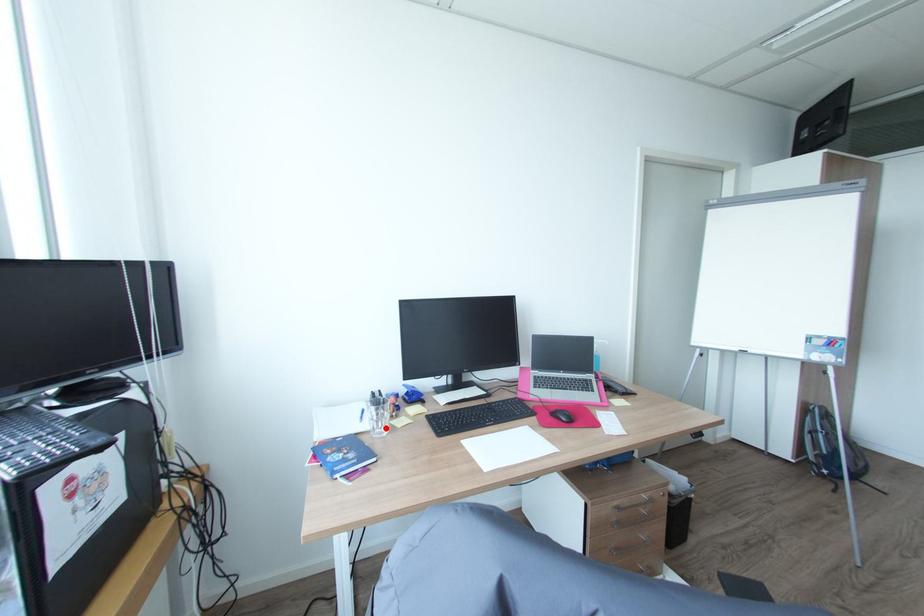
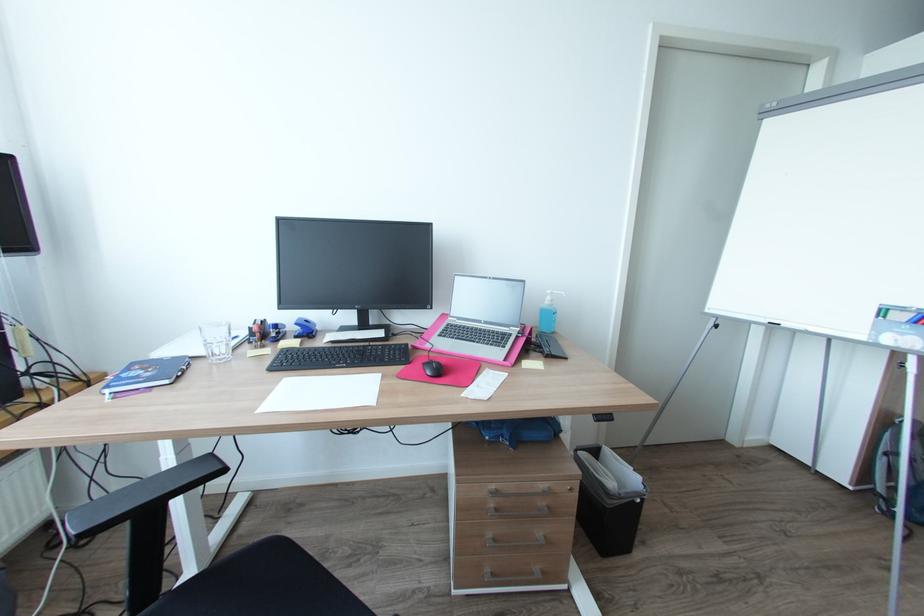
The point at the highlighted location is marked in the first image. Where is the corresponding point in the second image?

(225, 354)